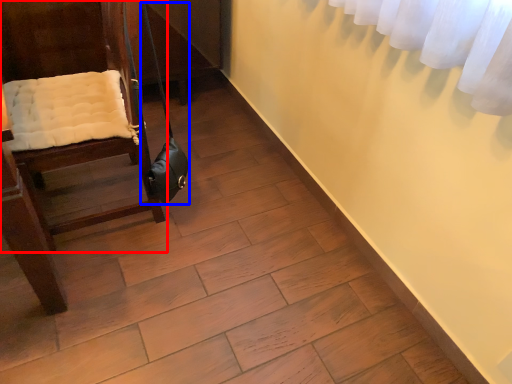
Question: Among these objects, which one is farthest to the camera, furniture (highlighted by a red box) or shoulder bag (highlighted by a blue box)?

Choices:
 (A) furniture
 (B) shoulder bag

Answer: (B)